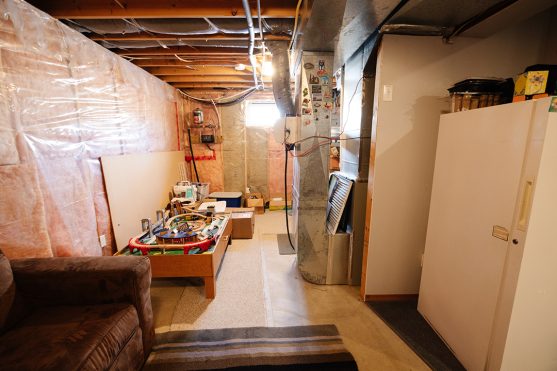
Where is `cables`? The image size is (557, 371). cables is located at coordinates (241, 92), (284, 178).